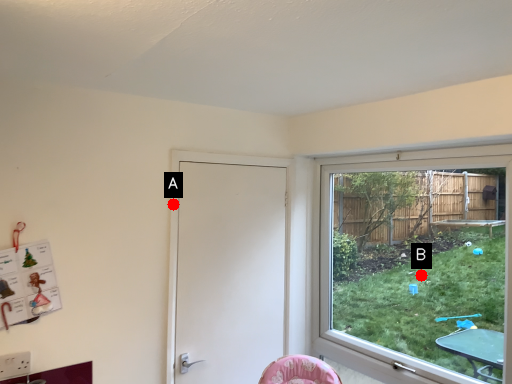
Question: Two points are circled on the image, labeled by A and B beside each circle. Which point is closer to the camera?

Choices:
 (A) A is closer
 (B) B is closer

Answer: (A)